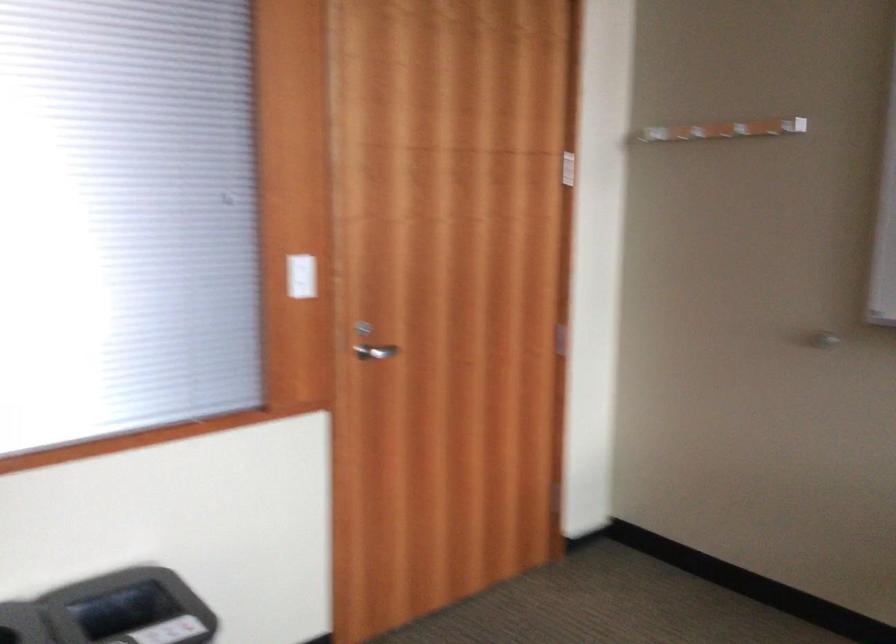
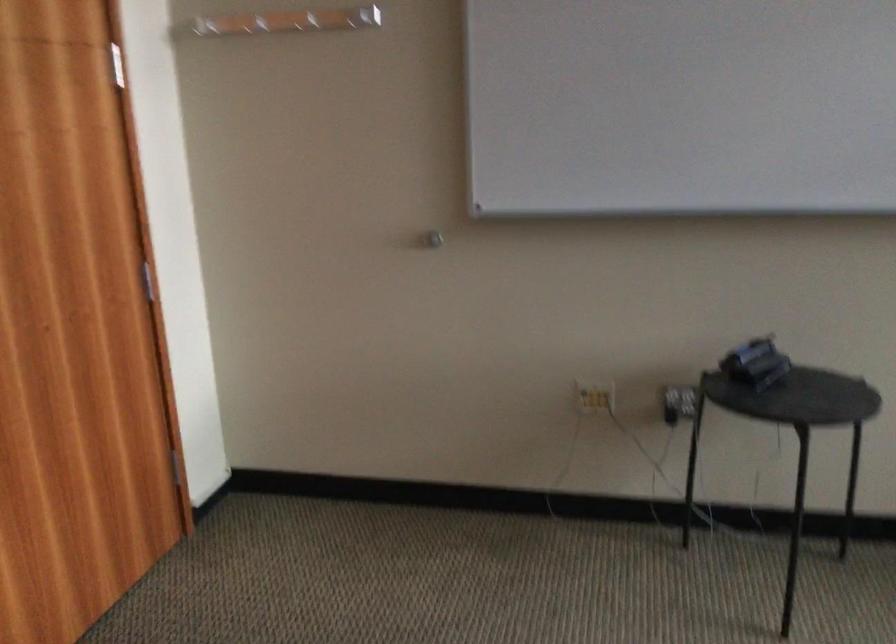
Question: Based on the continuous images, in which direction is the camera rotating? Reply with the corresponding letter.

Choices:
 (A) Left
 (B) Right
 (C) Up
 (D) Down

Answer: (B)